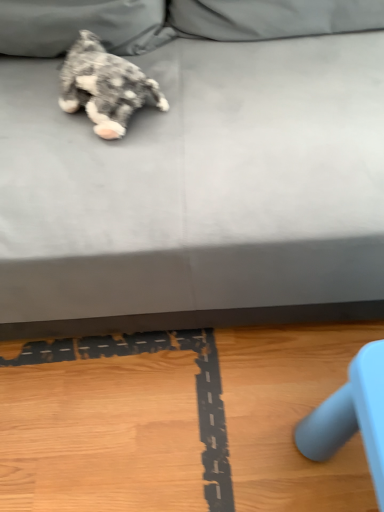
Where is `vacant space to the right of fluffy gray dog at upper left`? vacant space to the right of fluffy gray dog at upper left is located at coordinates (198, 87).